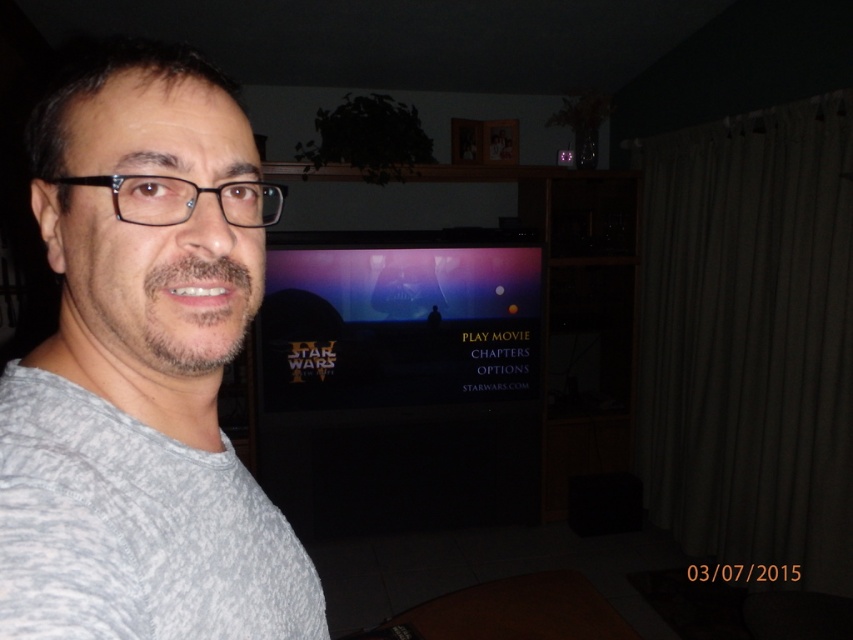
Question: Which object is the closest to the gray matte shirt at left?

Choices:
 (A) gray textured shirt at left
 (B) black glossy tv at center

Answer: (A)

Question: Which object is the closest to the gray textured shirt at left?

Choices:
 (A) black glossy tv at center
 (B) gray matte shirt at left

Answer: (B)

Question: Which object is farther from the camera taking this photo?

Choices:
 (A) black glossy tv at center
 (B) gray textured shirt at left

Answer: (A)

Question: Is gray matte shirt at left below black glossy tv at center?

Choices:
 (A) no
 (B) yes

Answer: (A)

Question: Is gray matte shirt at left bigger than gray textured shirt at left?

Choices:
 (A) no
 (B) yes

Answer: (B)

Question: Considering the relative positions of gray matte shirt at left and black glossy tv at center in the image provided, where is gray matte shirt at left located with respect to black glossy tv at center?

Choices:
 (A) below
 (B) above

Answer: (B)